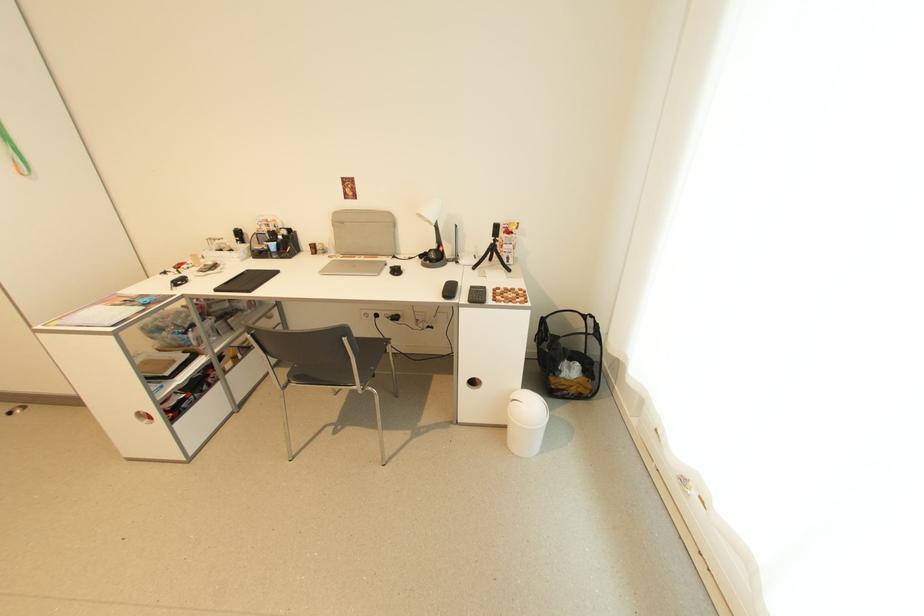
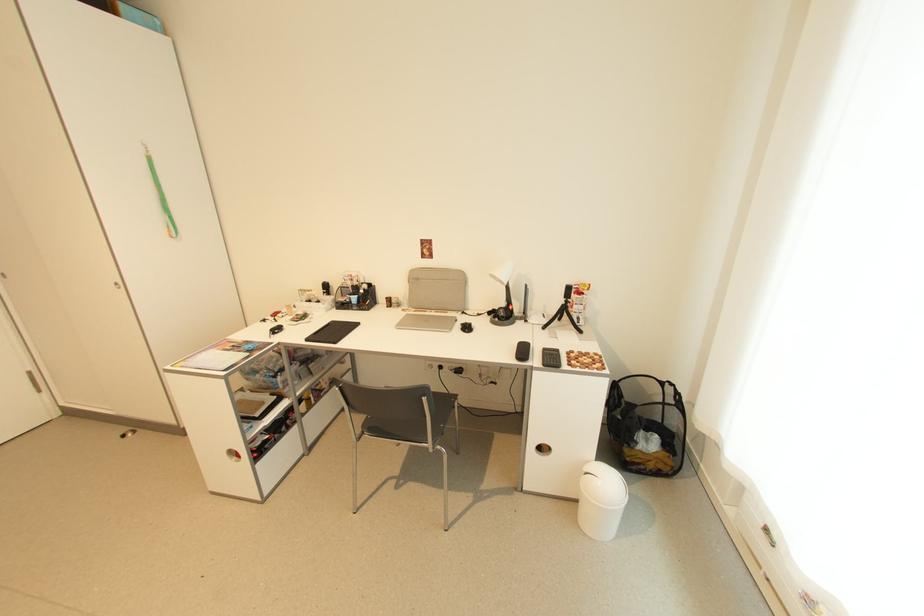
Question: The camera is either moving clockwise (left) or counter-clockwise (right) around the object. The first image is from the beginning of the video and the second image is from the end. Is the camera moving left or right when shooting the video?

Choices:
 (A) Left
 (B) Right

Answer: (B)